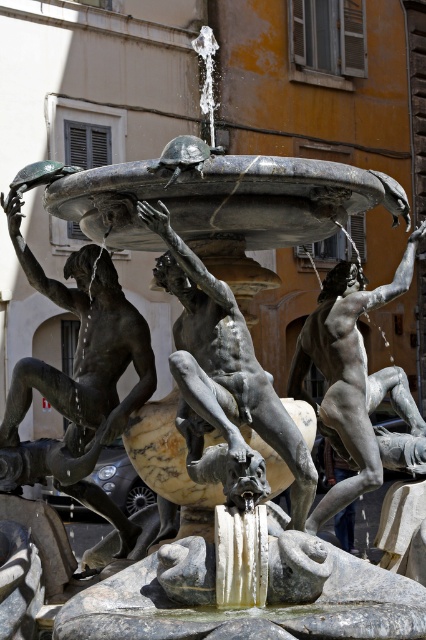
You are an art student analyzing the fountain sculpture. You notice two central statues, the bronze muscular figure at center and the polished silver statue at center. Which of these two statues is larger in size?

The polished silver statue at center is larger than the bronze muscular figure at center.

You are standing in front of the fountain and want to take a photo of the bronze muscular figure at center. If you move 0.1 units to the right along the x axis, will the figure move to the left in your photo?

Moving 0.1 units to the right along the x axis would shift your perspective, causing the bronze muscular figure at center to appear to move to the left in your photo.